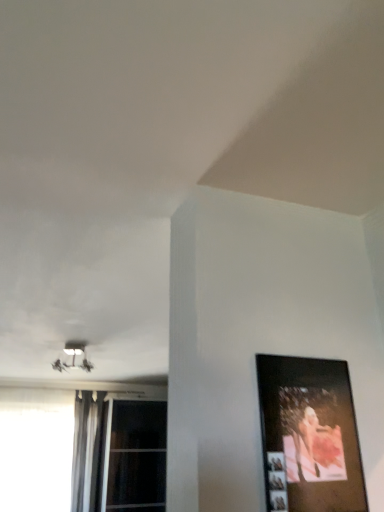
Question: Considering the relative positions of white glass window at lower left, the first window positioned from the left, and wooden picture frame at right in the image provided, is white glass window at lower left, the first window positioned from the left, in front of wooden picture frame at right?

Choices:
 (A) no
 (B) yes

Answer: (A)

Question: Is there a large distance between white glass window at lower left, the first window positioned from the left, and wooden picture frame at right?

Choices:
 (A) yes
 (B) no

Answer: (A)

Question: From a real-world perspective, is white glass window at lower left, the first window positioned from the left, physically below wooden picture frame at right?

Choices:
 (A) yes
 (B) no

Answer: (A)

Question: From the image's perspective, is white glass window at lower left, the first window positioned from the left, located beneath wooden picture frame at right?

Choices:
 (A) yes
 (B) no

Answer: (A)

Question: Can you confirm if white glass window at lower left, the first window positioned from the left, is smaller than wooden picture frame at right?

Choices:
 (A) no
 (B) yes

Answer: (A)

Question: Does white glass window at lower left, the first window positioned from the left, come behind wooden picture frame at right?

Choices:
 (A) yes
 (B) no

Answer: (A)

Question: From a real-world perspective, is white glass window at lower left, the first window positioned from the left, on silky gray curtain at left?

Choices:
 (A) yes
 (B) no

Answer: (B)

Question: Would you say white glass window at lower left, the second window from the right, contains silky gray curtain at left?

Choices:
 (A) yes
 (B) no

Answer: (B)

Question: Is white glass window at lower left, the second window from the right, taller than silky gray curtain at left?

Choices:
 (A) yes
 (B) no

Answer: (B)

Question: Considering the relative sizes of white glass window at lower left, the second window from the right, and silky gray curtain at left in the image provided, is white glass window at lower left, the second window from the right, bigger than silky gray curtain at left?

Choices:
 (A) yes
 (B) no

Answer: (A)

Question: Is white glass window at lower left, the second window from the right, positioned far away from silky gray curtain at left?

Choices:
 (A) no
 (B) yes

Answer: (A)

Question: Is white glass window at lower left, the first window positioned from the left, oriented towards silky gray curtain at left?

Choices:
 (A) yes
 (B) no

Answer: (B)

Question: Is wooden picture frame at right wider than white plastic lamp at upper left?

Choices:
 (A) no
 (B) yes

Answer: (A)